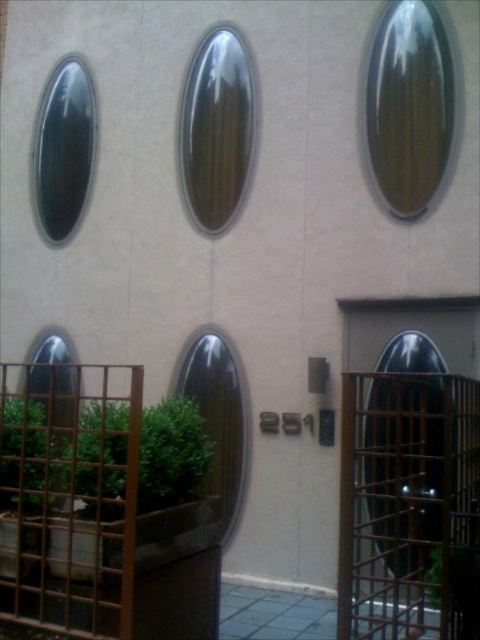
Who is positioned more to the right, glossy metallic oval at upper right or matte black oval at upper left?

Positioned to the right is glossy metallic oval at upper right.

Who is more forward, (410, 13) or (55, 152)?

Point (410, 13) is more forward.

You are a GUI agent. You are given a task and a screenshot of the screen. Output one action in this format:
    pyautogui.click(x=<x>, y=<y>)
    Task: Click on the glossy metallic oval at upper right
    The width and height of the screenshot is (480, 640).
    Given the screenshot: What is the action you would take?
    pyautogui.click(x=410, y=108)

Can you confirm if glossy glass oval at center is positioned above matte black oval at upper left?

Actually, glossy glass oval at center is below matte black oval at upper left.

Is glossy glass oval at center to the left of matte black oval at upper left from the viewer's perspective?

Incorrect, glossy glass oval at center is not on the left side of matte black oval at upper left.

Is point (236, 97) positioned after point (55, 220)?

That is False.

I want to click on glossy glass oval at center, so click(216, 129).

Which of these two, black glass door at center or matte black oval at upper left, stands shorter?

With less height is matte black oval at upper left.

Is black glass door at center smaller than matte black oval at upper left?

Incorrect, black glass door at center is not smaller in size than matte black oval at upper left.

Does point (396, 326) lie behind point (48, 129)?

That is False.

Identify the location of black glass door at center. This screenshot has height=640, width=480. (409, 470).